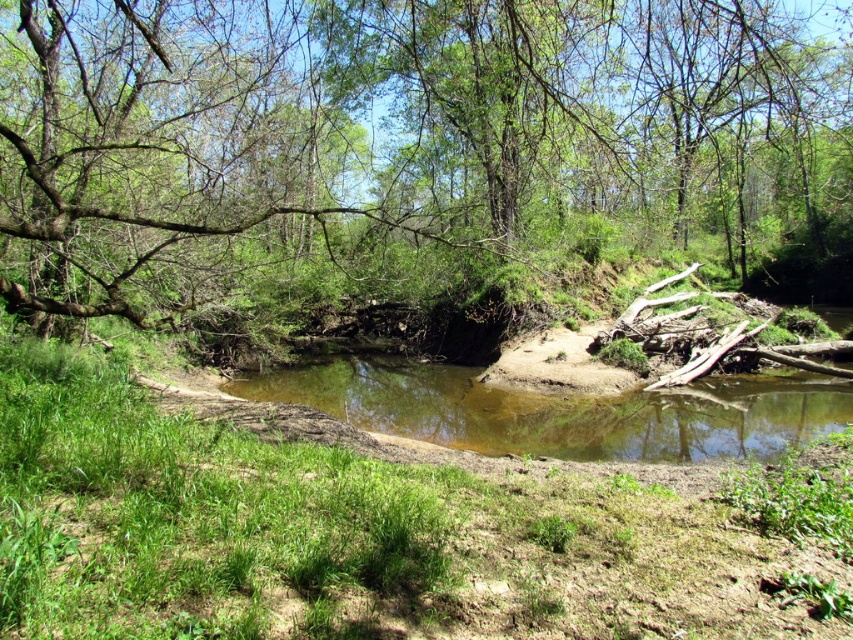
You are planning to build a small wooden bridge over the stream. The bridge needs to be wide enough to allow a bicycle to pass through. Considering the green leafy tree at center and the brown sandy river at center, which object should you consider in terms of size to ensure the bridge is appropriately sized?

The green leafy tree at center has a larger size compared to the brown sandy river at center. Therefore, when building the bridge, you should consider the size of the green leafy tree at center to ensure the bridge is wide enough to accommodate both the tree and the river.

You are a hiker trying to cross the brown sandy river at center. There is a green leafy tree at center nearby. Which is wider, the tree or the river?

The green leafy tree at center is wider than the brown sandy river at center.

From the picture: You are standing near the stream and want to take a photo of the green leafy tree at center and the brown sandy river at center. Which object should you focus on first to ensure both are in clear view?

You should focus on the green leafy tree at center first because it is closer to you than the brown sandy river at center, ensuring both are in clear view when focused on the nearer object.